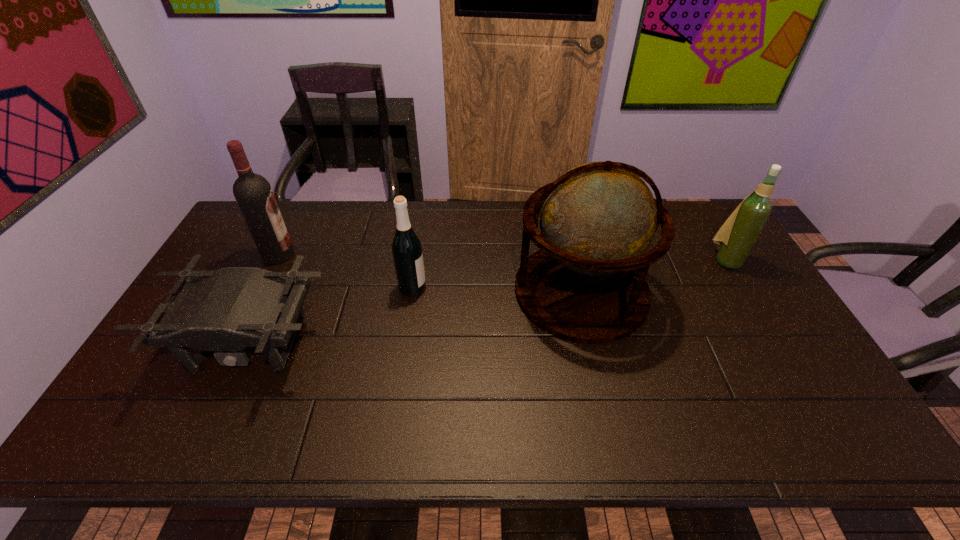
Identify the location of the fourth object from left to right. (586, 284).

Where is `the leftmost wine bottle`? the leftmost wine bottle is located at coordinates (253, 193).

What are the coordinates of `the rightmost wine bottle` in the screenshot? It's located at (735, 239).

Image resolution: width=960 pixels, height=540 pixels. Find the location of `the second wine bottle from left to right`. the second wine bottle from left to right is located at coordinates (406, 247).

Image resolution: width=960 pixels, height=540 pixels. I want to click on the third object from left to right, so click(406, 247).

Where is `drone`? This screenshot has width=960, height=540. drone is located at coordinates (226, 310).

This screenshot has height=540, width=960. I want to click on blank space located 0.150m on the front-facing side of the fourth object from left to right, so tap(465, 291).

The height and width of the screenshot is (540, 960). What are the coordinates of `vacant space located 0.230m on the front-facing side of the fourth object from left to right` in the screenshot? It's located at (438, 291).

Identify the location of free space located on the front-facing side of the fourth object from left to right. Image resolution: width=960 pixels, height=540 pixels. (428, 291).

This screenshot has width=960, height=540. Identify the location of free space located on the label of the leftmost wine bottle. pyautogui.click(x=348, y=255).